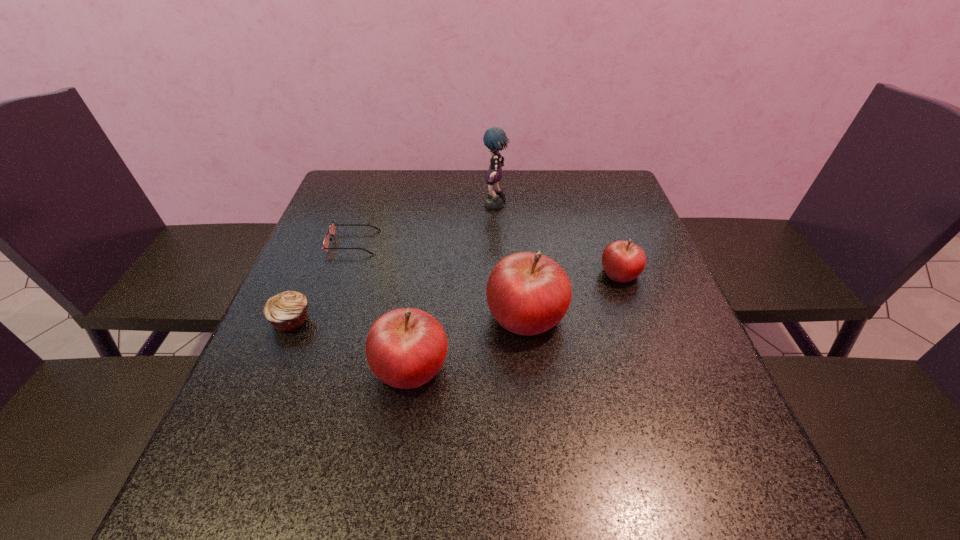
Where is `blank region between the sunglasses and the rightmost object`? blank region between the sunglasses and the rightmost object is located at coordinates (487, 258).

At what (x,y) coordinates should I click in order to perform the action: click on vacant space that's between the second apple from right to left and the third shortest object. Please return your answer as a coordinate pair (x, y). Looking at the image, I should click on (573, 294).

The width and height of the screenshot is (960, 540). Find the location of `free space between the second apple from left to right and the second shortest apple`. free space between the second apple from left to right and the second shortest apple is located at coordinates (468, 341).

This screenshot has height=540, width=960. Identify the location of free space between the fourth tallest object and the second apple from left to right. (573, 294).

Where is `empty space that is in between the farthest object and the shortest object`? empty space that is in between the farthest object and the shortest object is located at coordinates (424, 224).

Where is `free space between the fourth nearest object and the muffin`? free space between the fourth nearest object and the muffin is located at coordinates (456, 296).

Where is `object that is the fourth closest to the second apple from left to right`? This screenshot has height=540, width=960. object that is the fourth closest to the second apple from left to right is located at coordinates (331, 231).

You are a GUI agent. You are given a task and a screenshot of the screen. Output one action in this format:
    pyautogui.click(x=<x>, y=<y>)
    Task: Click on the object identified as the third closest to the muffin
    Image resolution: width=960 pixels, height=540 pixels.
    Given the screenshot: What is the action you would take?
    click(528, 293)

Locate an element on the screen. This screenshot has width=960, height=540. apple that is the nearest to the second apple from right to left is located at coordinates (405, 348).

At what (x,y) coordinates should I click in order to perform the action: click on apple that stands as the third closest to the shortest object. Please return your answer as a coordinate pair (x, y). The height and width of the screenshot is (540, 960). Looking at the image, I should click on (623, 261).